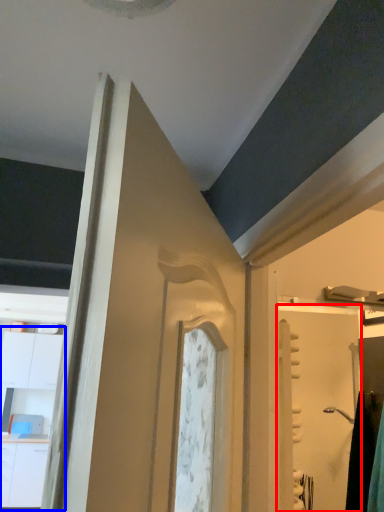
Question: Which point is further to the camera, screen door (highlighted by a red box) or dresser (highlighted by a blue box)?

Choices:
 (A) screen door
 (B) dresser

Answer: (B)